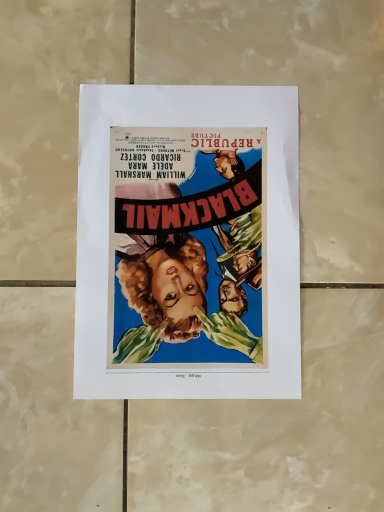
The width and height of the screenshot is (384, 512). Identify the location of vacant space situated above vibrant paper poster at center (from a real-world perspective). pos(197,237).